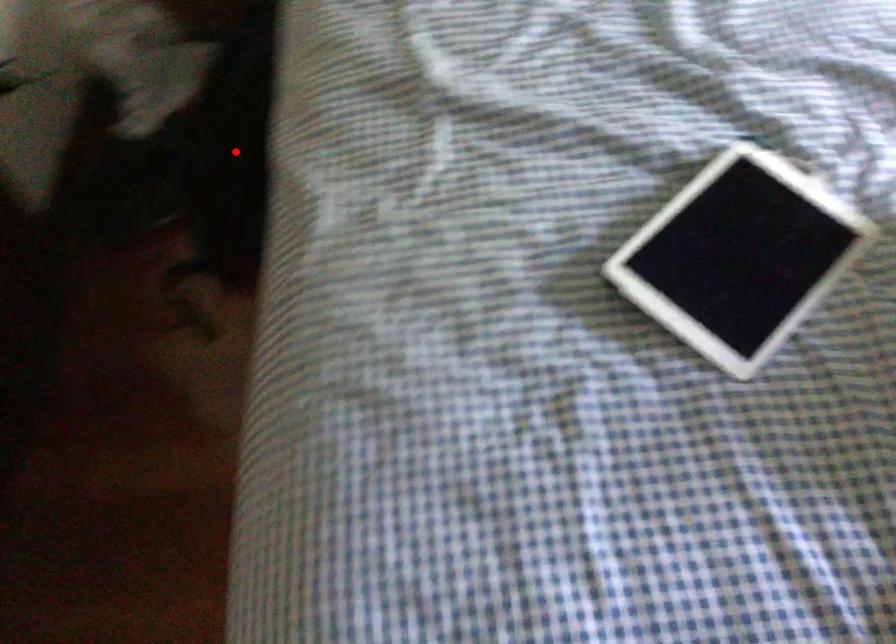
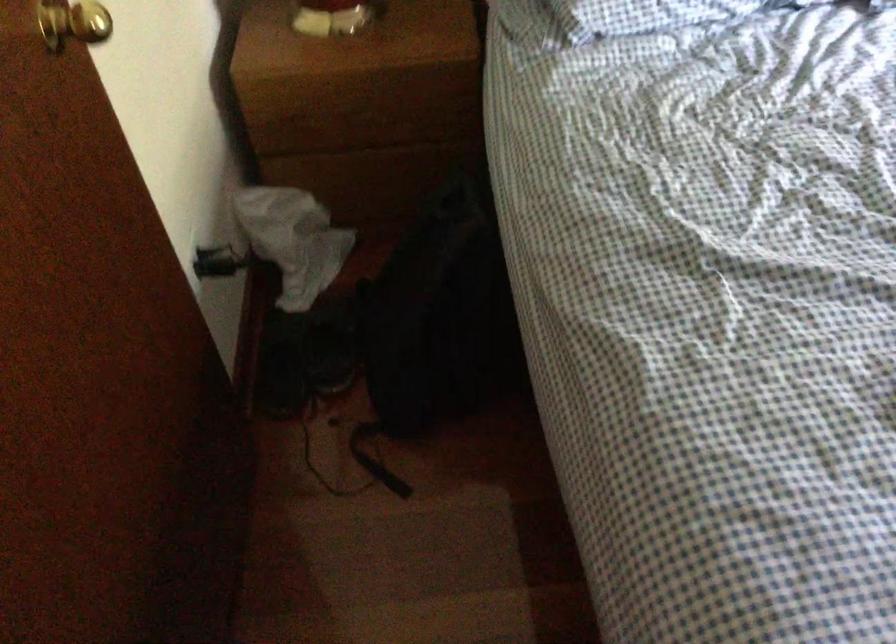
Locate, in the second image, the point that corresponds to the highlighted location in the first image.

(441, 317)